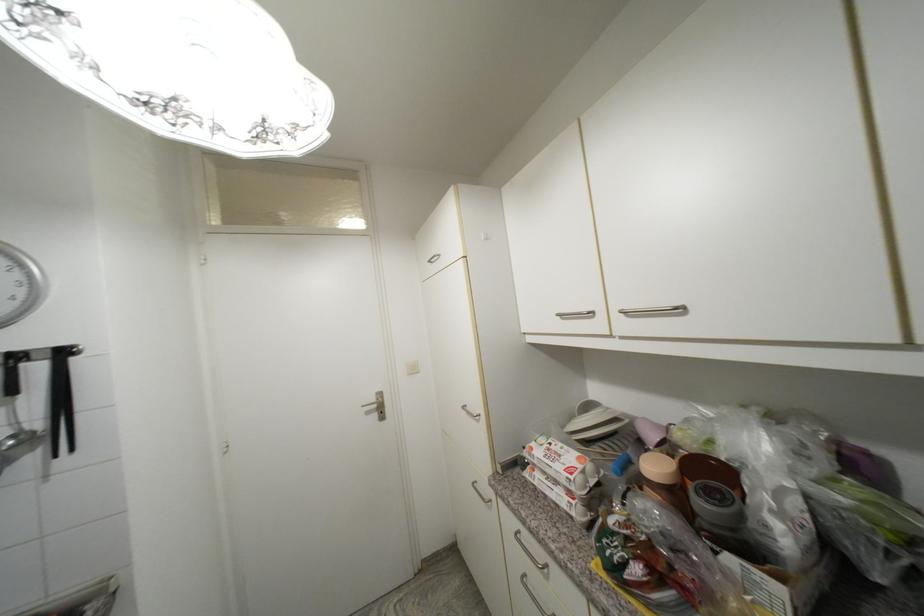
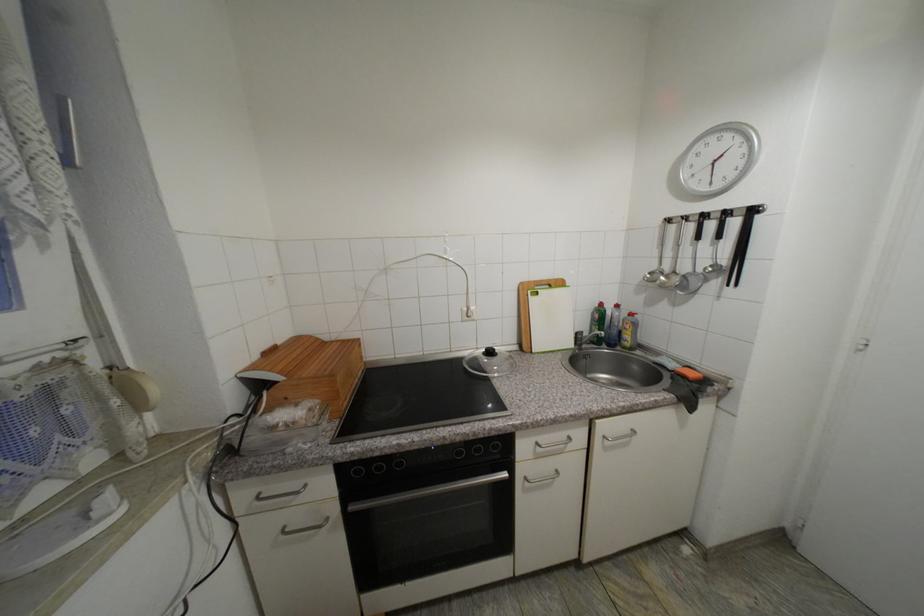
Based on the continuous images, in which direction is the camera rotating?

The rotation direction of the camera is left-down.